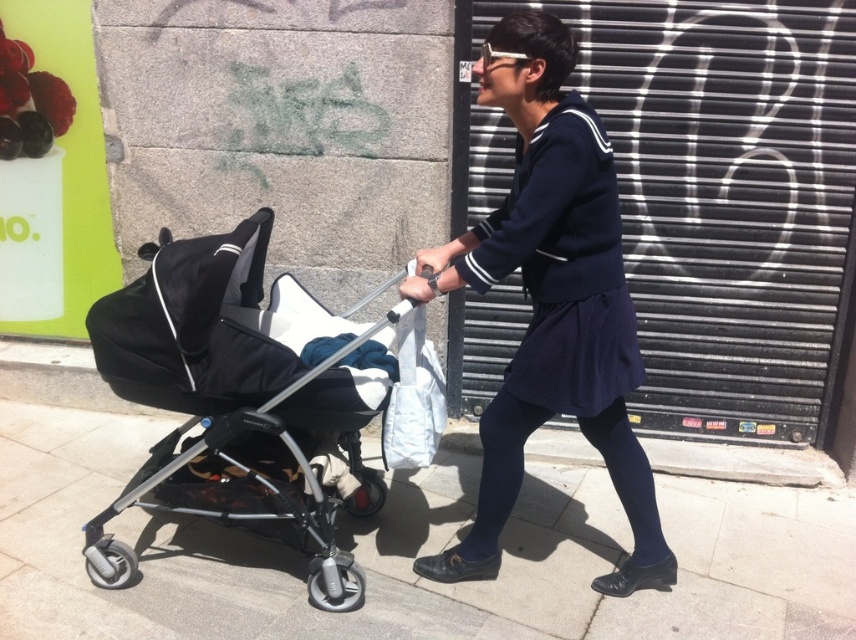
Question: Does gray concrete pavement at center have a smaller size compared to black matte stroller at left?

Choices:
 (A) yes
 (B) no

Answer: (B)

Question: Is gray concrete pavement at center above navy blue dress at center?

Choices:
 (A) no
 (B) yes

Answer: (A)

Question: Which of the following is the closest to the observer?

Choices:
 (A) pyautogui.click(x=277, y=451)
 (B) pyautogui.click(x=474, y=493)
 (C) pyautogui.click(x=508, y=490)

Answer: (C)

Question: Which point is closer to the camera?

Choices:
 (A) (278, 352)
 (B) (652, 584)

Answer: (A)

Question: Does navy blue dress at center come behind black matte stroller at left?

Choices:
 (A) no
 (B) yes

Answer: (A)

Question: Among these points, which one is nearest to the camera?

Choices:
 (A) (431, 291)
 (B) (140, 374)

Answer: (A)